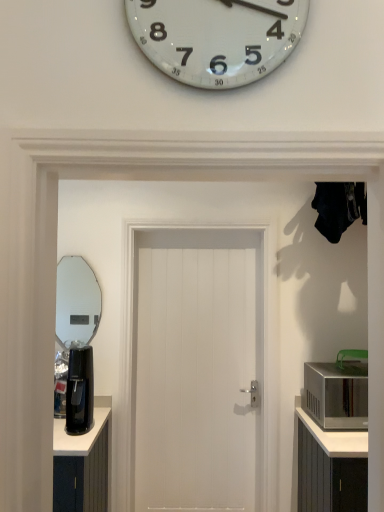
Measure the distance between point (65, 340) and camera.

A distance of 3.96 meters exists between point (65, 340) and camera.

Identify the location of clear glass mirror at left. [x=77, y=302].

In order to click on white wooden door at center in this screenshot , I will do `click(196, 369)`.

Does clear glass mirror at left have a smaller size compared to black plastic coffee machine at left?

Indeed, clear glass mirror at left has a smaller size compared to black plastic coffee machine at left.

How far apart are clear glass mirror at left and black plastic coffee machine at left?

clear glass mirror at left is 4.98 feet away from black plastic coffee machine at left.

At what (x,y) coordinates should I click in order to perform the action: click on mirror located above the black plastic coffee machine at left (from the image's perspective). Please return your answer as a coordinate pair (x, y). The image size is (384, 512). Looking at the image, I should click on (77, 302).

Is point (80, 278) more distant than point (87, 401)?

Yes, point (80, 278) is farther from viewer.

At what (x,y) coordinates should I click in order to perform the action: click on mirror lying on the left of silver metallic microwave at right. Please return your answer as a coordinate pair (x, y). Looking at the image, I should click on (77, 302).

Relative to clear glass mirror at left, is silver metallic microwave at right in front or behind?

silver metallic microwave at right is in front of clear glass mirror at left.

From a real-world perspective, is silver metallic microwave at right above or below clear glass mirror at left?

silver metallic microwave at right is below clear glass mirror at left.

Considering the positions of point (69, 385) and point (60, 319), is point (69, 385) closer or farther from the camera than point (60, 319)?

Point (69, 385) is closer to the camera than point (60, 319).

Who is bigger, black plastic coffee machine at left or clear glass mirror at left?

With larger size is black plastic coffee machine at left.

Is black plastic coffee machine at left with clear glass mirror at left?

There is a gap between black plastic coffee machine at left and clear glass mirror at left.

From the image's perspective, would you say clear glass mirror at left is positioned over silver metallic microwave at right?

Correct, clear glass mirror at left appears higher than silver metallic microwave at right in the image.

From their relative heights in the image, would you say clear glass mirror at left is taller or shorter than silver metallic microwave at right?

In the image, clear glass mirror at left appears to be taller than silver metallic microwave at right.

Choose the correct answer: Is clear glass mirror at left inside silver metallic microwave at right or outside it?

clear glass mirror at left is outside silver metallic microwave at right.

From the picture: Considering the relative sizes of clear glass mirror at left and silver metallic microwave at right in the image provided, is clear glass mirror at left thinner than silver metallic microwave at right?

Correct, the width of clear glass mirror at left is less than that of silver metallic microwave at right.

From the image's perspective, would you say silver metallic microwave at right is shown under black plastic coffee machine at left?

Yes.

Is silver metallic microwave at right wider than black plastic coffee machine at left?

Yes, silver metallic microwave at right is wider than black plastic coffee machine at left.

Is silver metallic microwave at right not inside black plastic coffee machine at left?

Yes, silver metallic microwave at right is not within black plastic coffee machine at left.

Based on the photo, which object is closer to the camera, silver metallic microwave at right or black plastic coffee machine at left?

black plastic coffee machine at left is more forward.

From the picture: Between white wooden door at center and black plastic coffee machine at left, which one has less height?

Standing shorter between the two is black plastic coffee machine at left.

From the picture: How much distance is there between white wooden door at center and black plastic coffee machine at left?

They are 26.88 inches apart.

Which object is positioned more to the right, white wooden door at center or black plastic coffee machine at left?

From the viewer's perspective, white wooden door at center appears more on the right side.

Is white wooden door at center spatially inside black plastic coffee machine at left, or outside of it?

white wooden door at center lies outside black plastic coffee machine at left.

Which object is further away from the camera taking this photo, white wooden door at center or silver metallic microwave at right?

Positioned behind is white wooden door at center.

Which object is wider, white wooden door at center or silver metallic microwave at right?

silver metallic microwave at right.

Where is `door that appears behind the silver metallic microwave at right`? door that appears behind the silver metallic microwave at right is located at coordinates (196, 369).

Is silver metallic microwave at right at the back of white wooden door at center?

That's not correct — white wooden door at center is not looking away from silver metallic microwave at right.

Image resolution: width=384 pixels, height=512 pixels. What are the coordinates of `mirror to the left of black plastic coffee machine at left` in the screenshot? It's located at (77, 302).

Where is `appliance on the right of the clear glass mirror at left`? This screenshot has height=512, width=384. appliance on the right of the clear glass mirror at left is located at coordinates (338, 392).

From the picture: Estimate the real-world distances between objects in this image. Which object is closer to white wooden door at center, black plastic coffee machine at left or silver metallic microwave at right?

black plastic coffee machine at left.

Looking at the image, which one is located further to white wooden door at center, silver metallic microwave at right or clear glass mirror at left?

Based on the image, clear glass mirror at left appears to be further to white wooden door at center.

When comparing their distances from black plastic coffee machine at left, does silver metallic microwave at right or clear glass mirror at left seem further?

clear glass mirror at left lies further to black plastic coffee machine at left than the other object.

Looking at the image, which one is located closer to clear glass mirror at left, silver metallic microwave at right or black plastic coffee machine at left?

black plastic coffee machine at left is closer to clear glass mirror at left.

When comparing their distances from silver metallic microwave at right, does white wooden door at center or black plastic coffee machine at left seem further?

black plastic coffee machine at left lies further to silver metallic microwave at right than the other object.

Based on their spatial positions, is clear glass mirror at left or black plastic coffee machine at left closer to silver metallic microwave at right?

Among the two, black plastic coffee machine at left is located nearer to silver metallic microwave at right.

When comparing their distances from white wooden door at center, does black plastic coffee machine at left or clear glass mirror at left seem further?

clear glass mirror at left is positioned further to the anchor white wooden door at center.

Based on their spatial positions, is white wooden door at center or clear glass mirror at left closer to black plastic coffee machine at left?

white wooden door at center is positioned closer to the anchor black plastic coffee machine at left.

The height and width of the screenshot is (512, 384). I want to click on door between black plastic coffee machine at left and silver metallic microwave at right, so click(x=196, y=369).

At what (x,y) coordinates should I click in order to perform the action: click on coffee machine between clear glass mirror at left and white wooden door at center from left to right. Please return your answer as a coordinate pair (x, y). This screenshot has width=384, height=512. Looking at the image, I should click on (80, 391).

Identify the location of coffee machine situated between clear glass mirror at left and silver metallic microwave at right from left to right. (80, 391).

Locate an element on the screen. The image size is (384, 512). door between clear glass mirror at left and silver metallic microwave at right from left to right is located at coordinates (196, 369).